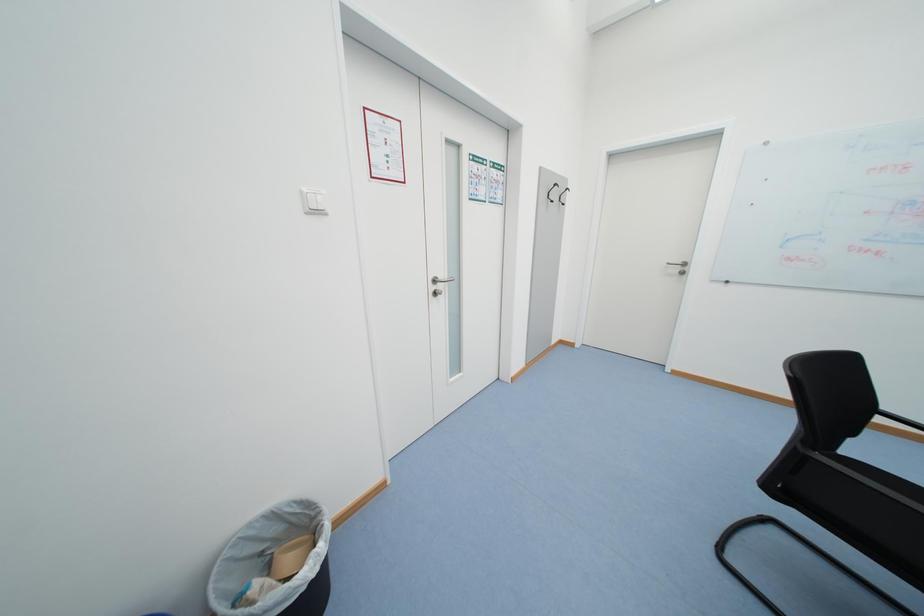
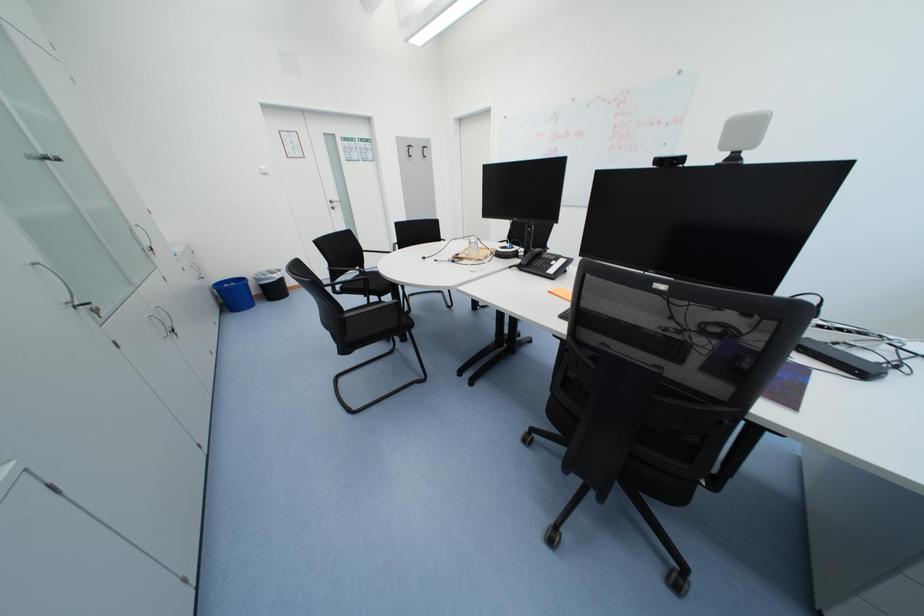
Which direction would the cameraman need to move to produce the second image?

The movement direction of the cameraman is right, backward.